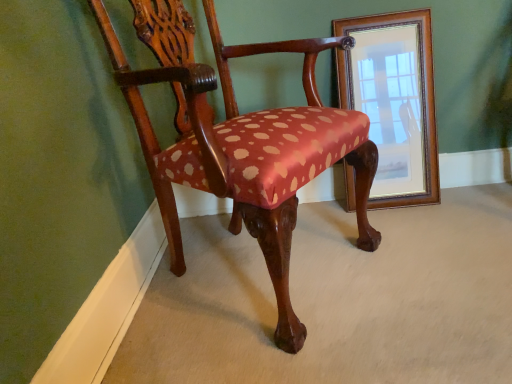
Question: Is polished wood chair at center turned away from wooden framed mirror at upper right?

Choices:
 (A) no
 (B) yes

Answer: (A)

Question: From a real-world perspective, is polished wood chair at center located beneath wooden framed mirror at upper right?

Choices:
 (A) no
 (B) yes

Answer: (A)

Question: Is polished wood chair at center next to wooden framed mirror at upper right and touching it?

Choices:
 (A) yes
 (B) no

Answer: (B)

Question: Is polished wood chair at center at the left side of wooden framed mirror at upper right?

Choices:
 (A) yes
 (B) no

Answer: (A)

Question: Is polished wood chair at center bigger than wooden framed mirror at upper right?

Choices:
 (A) no
 (B) yes

Answer: (B)

Question: Is polished wood chair at center to the right of wooden framed mirror at upper right from the viewer's perspective?

Choices:
 (A) no
 (B) yes

Answer: (A)

Question: Can you confirm if wooden framed mirror at upper right is shorter than polished wood chair at center?

Choices:
 (A) no
 (B) yes

Answer: (B)

Question: Is wooden framed mirror at upper right at the right side of polished wood chair at center?

Choices:
 (A) yes
 (B) no

Answer: (A)

Question: From a real-world perspective, is wooden framed mirror at upper right positioned under polished wood chair at center based on gravity?

Choices:
 (A) no
 (B) yes

Answer: (B)

Question: Is wooden framed mirror at upper right next to polished wood chair at center and touching it?

Choices:
 (A) yes
 (B) no

Answer: (B)

Question: Can you confirm if wooden framed mirror at upper right is smaller than polished wood chair at center?

Choices:
 (A) no
 (B) yes

Answer: (B)

Question: Considering the relative sizes of wooden framed mirror at upper right and polished wood chair at center in the image provided, is wooden framed mirror at upper right bigger than polished wood chair at center?

Choices:
 (A) no
 (B) yes

Answer: (A)

Question: Is wooden framed mirror at upper right bigger or smaller than polished wood chair at center?

Choices:
 (A) small
 (B) big

Answer: (A)